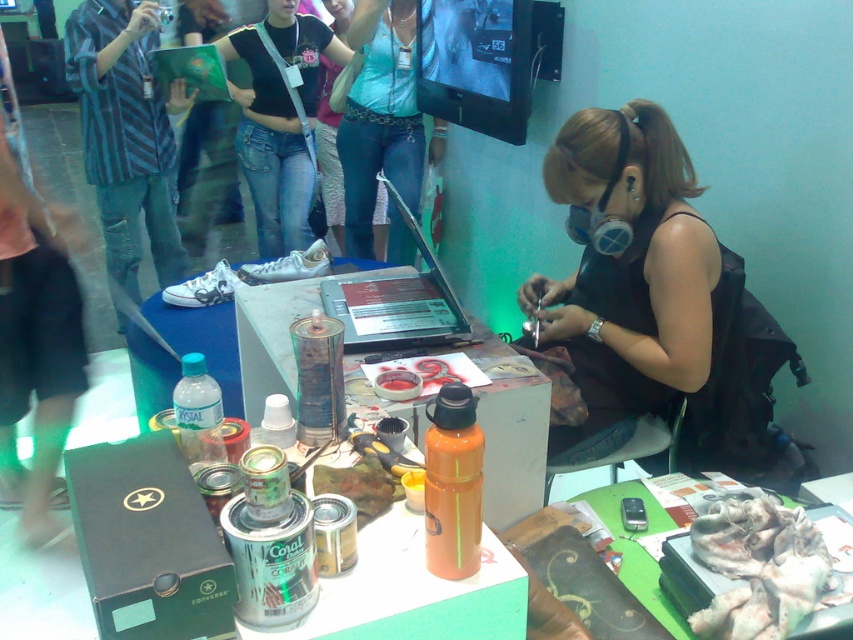
How far apart are matte black tank top at center and blue denim jeans at center?

matte black tank top at center is 5.15 feet away from blue denim jeans at center.

Which of these two, matte black tank top at center or blue denim jeans at center, stands shorter?

matte black tank top at center

This screenshot has height=640, width=853. I want to click on matte black tank top at center, so click(625, 266).

Locate an element on the screen. This screenshot has height=640, width=853. matte black tank top at center is located at coordinates (625, 266).

Who is lower down, matte black tank top at center or fuzzy white fabric at lower right?

fuzzy white fabric at lower right

Can you confirm if matte black tank top at center is wider than fuzzy white fabric at lower right?

Correct, the width of matte black tank top at center exceeds that of fuzzy white fabric at lower right.

Where is `matte black tank top at center`? matte black tank top at center is located at coordinates (625, 266).

At what (x,y) coordinates should I click in order to perform the action: click on matte black tank top at center. Please return your answer as a coordinate pair (x, y). Looking at the image, I should click on (625, 266).

Based on the photo, can you confirm if fuzzy white fabric at lower right is positioned below orange matte water bottle at lower right?

Incorrect, fuzzy white fabric at lower right is not positioned below orange matte water bottle at lower right.

The height and width of the screenshot is (640, 853). What do you see at coordinates (761, 568) in the screenshot?
I see `fuzzy white fabric at lower right` at bounding box center [761, 568].

The width and height of the screenshot is (853, 640). In order to click on fuzzy white fabric at lower right in this screenshot , I will do (x=761, y=568).

Locate an element on the screen. This screenshot has height=640, width=853. fuzzy white fabric at lower right is located at coordinates (761, 568).